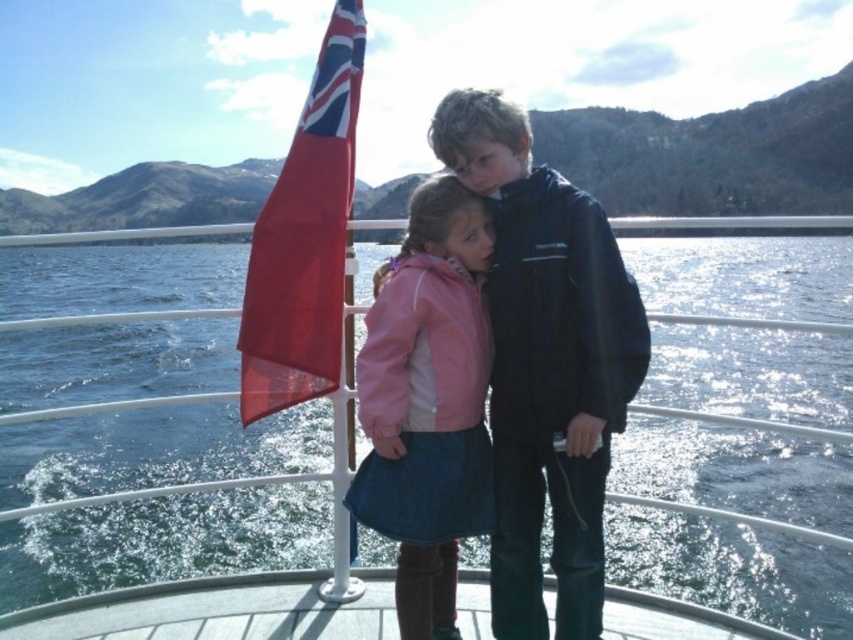
Question: Which of the following is the closest to the observer?

Choices:
 (A) (817, 552)
 (B) (422, 461)

Answer: (B)

Question: Does glistening blue water at center have a lesser width compared to red fabric flag at left?

Choices:
 (A) no
 (B) yes

Answer: (A)

Question: Which point is farther to the camera?

Choices:
 (A) glistening blue water at center
 (B) red fabric flag at left
 (C) pink matte jacket at center
 (D) smooth wooden deck at center

Answer: (B)

Question: Does pink matte jacket at center have a greater width compared to red fabric flag at left?

Choices:
 (A) yes
 (B) no

Answer: (B)

Question: Can you confirm if glistening blue water at center is positioned to the right of red fabric flag at left?

Choices:
 (A) yes
 (B) no

Answer: (A)

Question: Which of the following is the closest to the observer?

Choices:
 (A) glistening blue water at center
 (B) red fabric flag at left

Answer: (A)